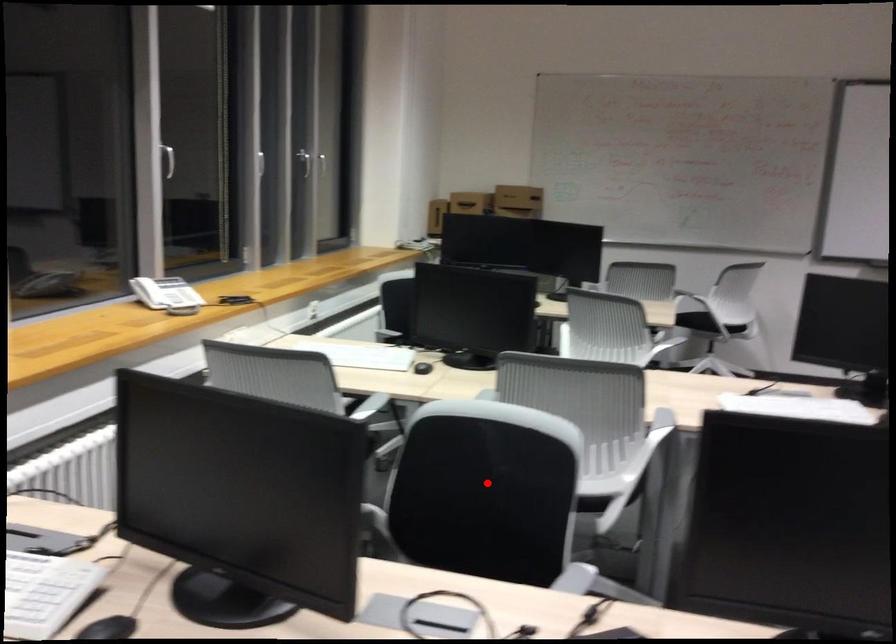
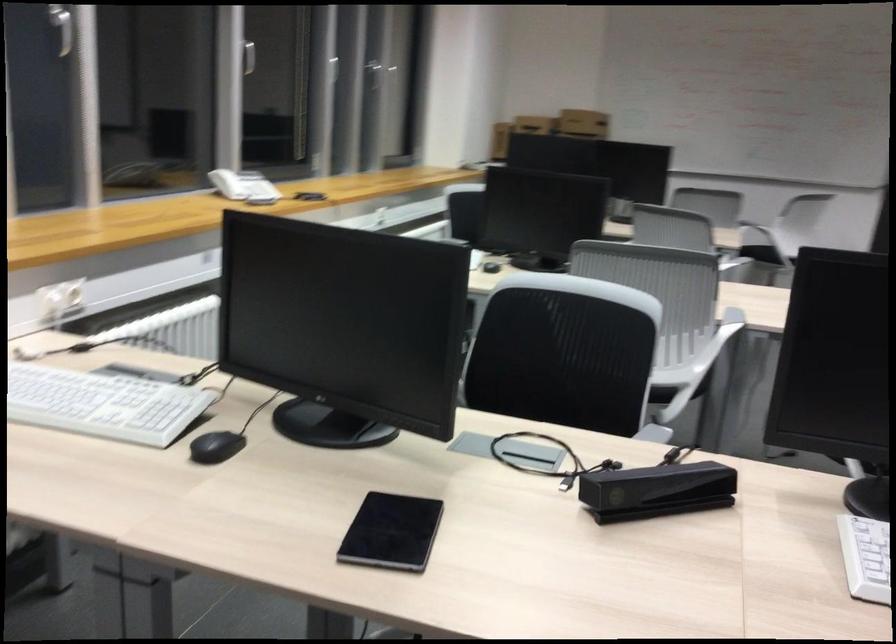
Question: I am providing you with two images of the same scene from different viewpoints. A red point is marked on the first image. At the location where the point appears in image 1, is it still visible in image 2?

Choices:
 (A) Yes
 (B) No

Answer: (A)